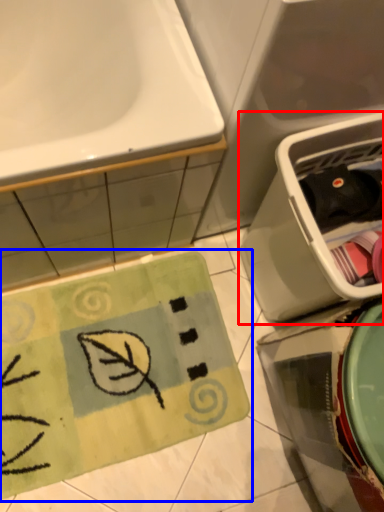
Question: Among these objects, which one is farthest to the camera, dish washer (highlighted by a red box) or doormat (highlighted by a blue box)?

Choices:
 (A) dish washer
 (B) doormat

Answer: (B)